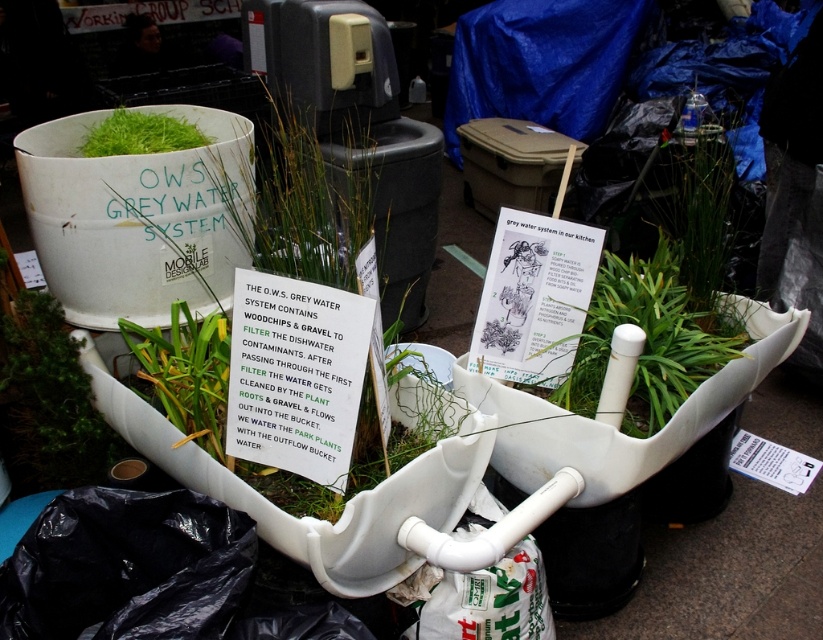
You are standing next to the camera and want to water the green matte plant at lower left using a watering can that has a 5 feet long handle. Can you reach the plant without moving the watering can or the plant?

The green matte plant at lower left and camera are 4.92 feet apart from each other. Since the watering can has a 5 feet long handle, you can reach the plant by extending the handle fully as the distance is slightly less than the handle length.

What is the height relationship between the green matte plant at lower left and the green grassy plant at center in the grey water system setup?

The green matte plant at lower left has a lesser height compared to the green grassy plant at center.